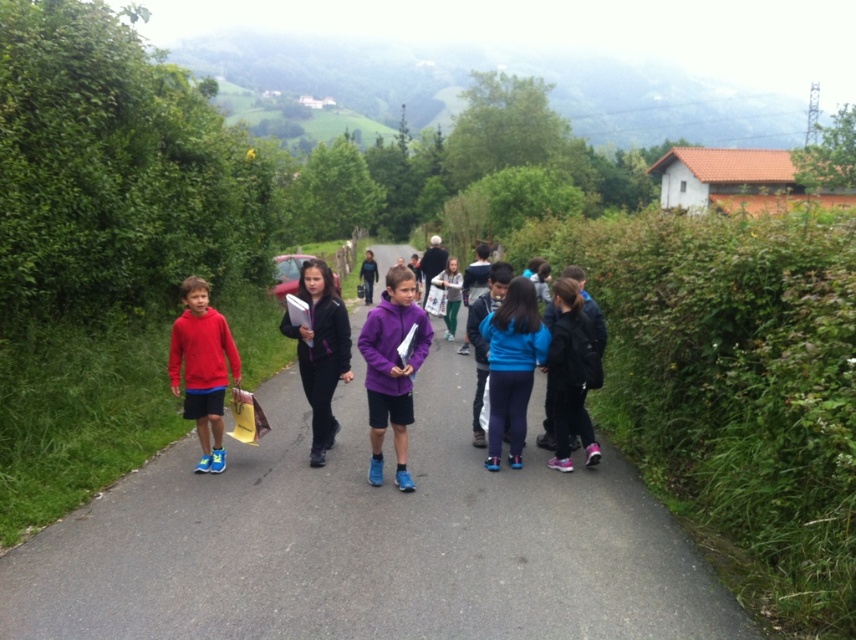
You are a photographer positioned at point (286, 317) and want to take a photo of the children walking along the road. There is an obstruction at point (563, 556). Will the obstruction block your view of the children?

Point (563, 556) is in front of point (286, 317), so the obstruction at point (563, 556) will block your view of the children.